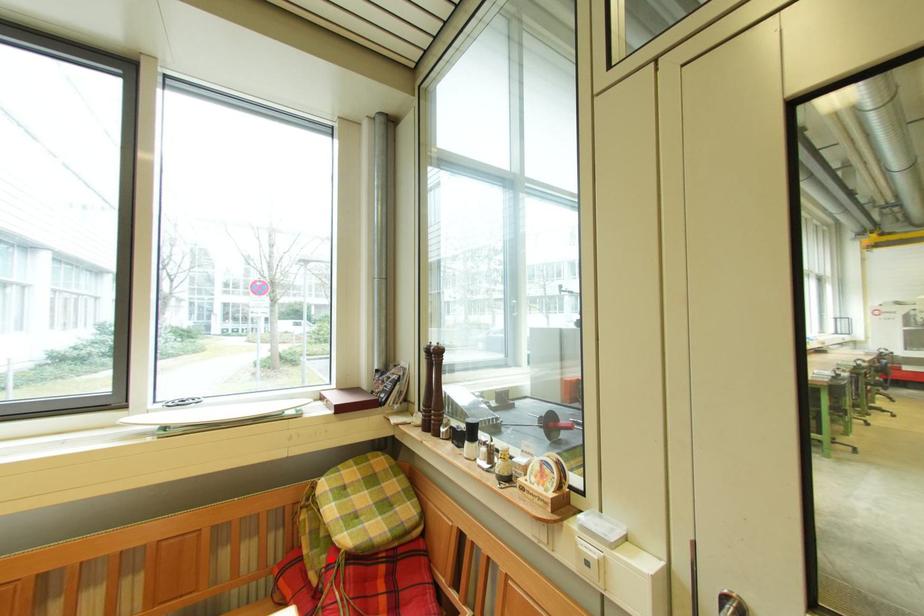
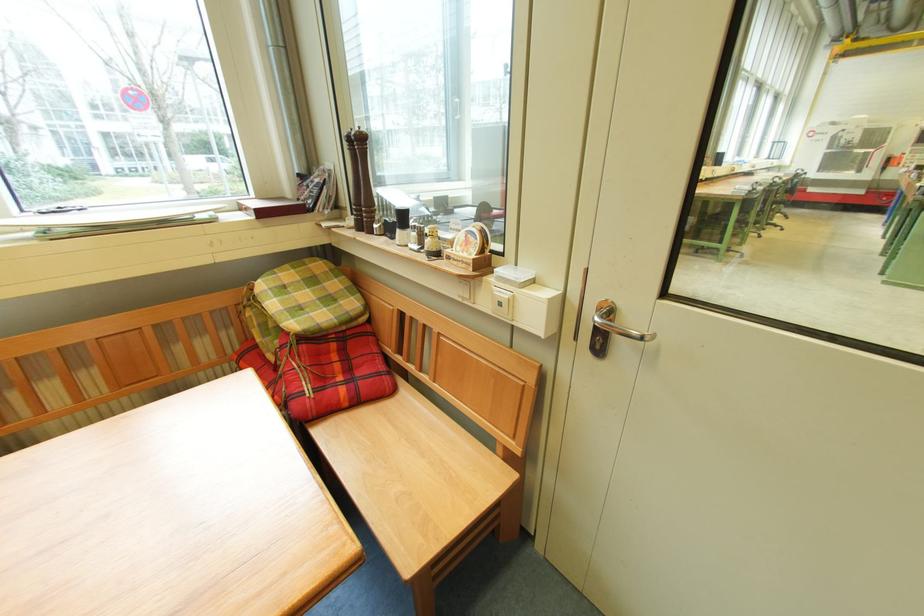
The point at the highlighted location is marked in the first image. Where is the corresponding point in the second image?

(285, 344)